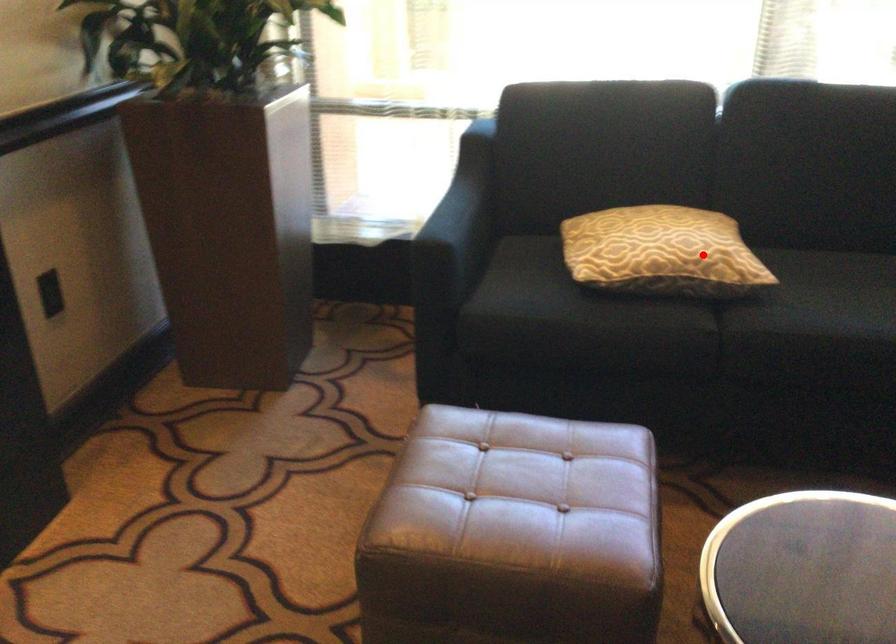
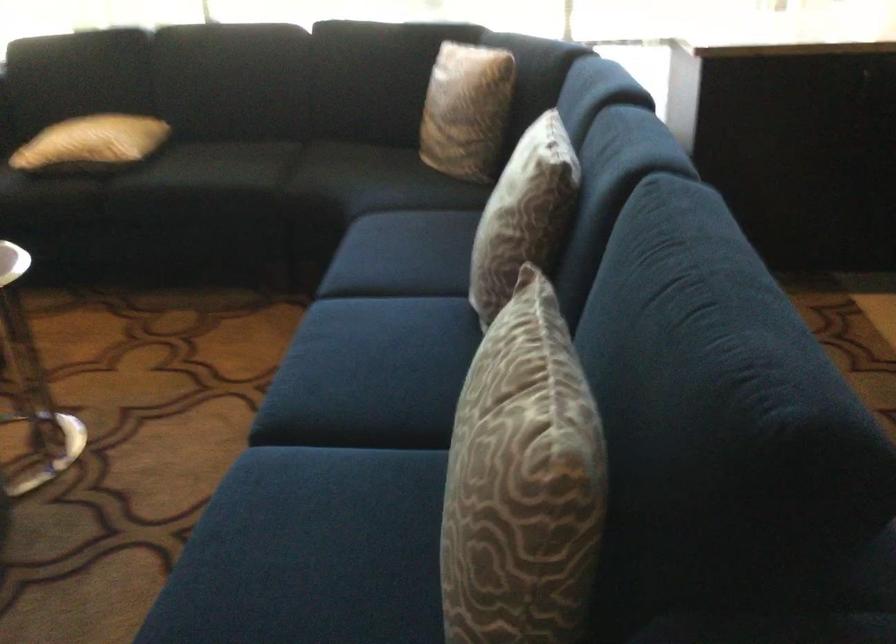
Question: I am providing you with two images of the same scene from different viewpoints. Image1 has a red point marked. In image2, the corresponding 3D location appears at what relative position? Reply with the corresponding letter.

Choices:
 (A) Closer
 (B) Farther

Answer: (B)